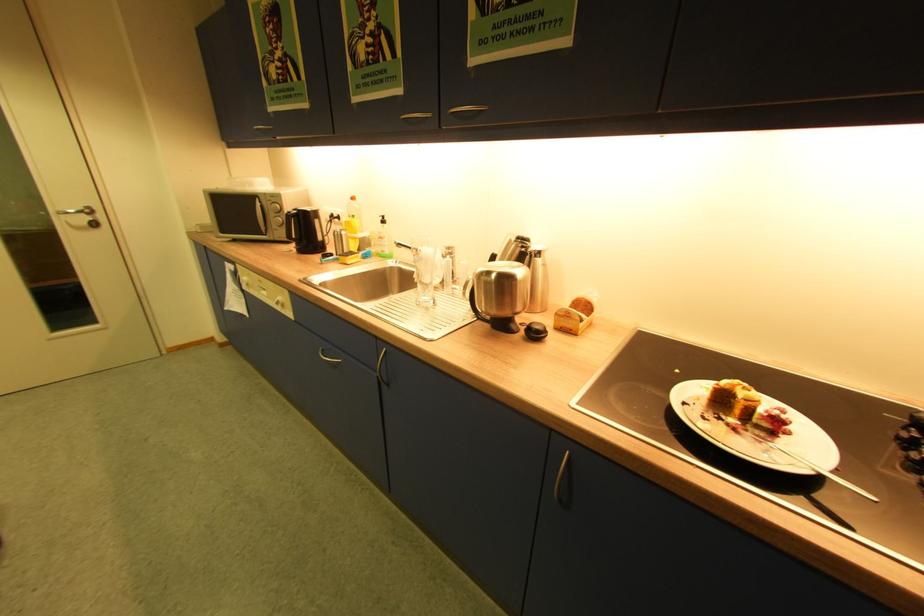
What do you see at coordinates (405, 246) in the screenshot? I see `the faucet handle` at bounding box center [405, 246].